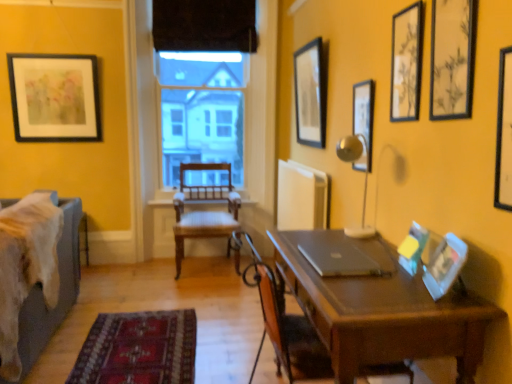
Question: From the image's perspective, is sleek silver laptop at center located beneath matte black picture frame at upper right, positioned as the 6th picture frame in right-to-left order?

Choices:
 (A) no
 (B) yes

Answer: (B)

Question: From a real-world perspective, is sleek silver laptop at center on top of matte black picture frame at upper right, positioned as the 6th picture frame in right-to-left order?

Choices:
 (A) yes
 (B) no

Answer: (B)

Question: Is sleek silver laptop at center at the right side of matte black picture frame at upper right, positioned as the 6th picture frame in right-to-left order?

Choices:
 (A) yes
 (B) no

Answer: (B)

Question: Considering the relative sizes of sleek silver laptop at center and matte black picture frame at upper right, which appears as the 3th picture frame when viewed from the left, in the image provided, is sleek silver laptop at center wider than matte black picture frame at upper right, which appears as the 3th picture frame when viewed from the left,?

Choices:
 (A) yes
 (B) no

Answer: (A)

Question: Is sleek silver laptop at center taller than matte black picture frame at upper right, positioned as the 6th picture frame in right-to-left order?

Choices:
 (A) no
 (B) yes

Answer: (A)

Question: Is black velvet curtain at upper center in front of or behind matte plastic picture frame at right, marked as the 5th picture frame in a right-to-left arrangement, in the image?

Choices:
 (A) front
 (B) behind

Answer: (B)

Question: Is black velvet curtain at upper center inside the boundaries of matte plastic picture frame at right, marked as the 5th picture frame in a right-to-left arrangement, or outside?

Choices:
 (A) outside
 (B) inside

Answer: (A)

Question: Considering the relative positions of black velvet curtain at upper center and matte plastic picture frame at right, which is counted as the 5th picture frame, starting from the back, in the image provided, is black velvet curtain at upper center to the left or to the right of matte plastic picture frame at right, which is counted as the 5th picture frame, starting from the back,?

Choices:
 (A) right
 (B) left

Answer: (B)

Question: From the image's perspective, is black velvet curtain at upper center above or below matte plastic picture frame at right, acting as the fourth picture frame starting from the front?

Choices:
 (A) below
 (B) above

Answer: (B)

Question: In terms of size, does matte black picture frame at upper left, placed as the 1th picture frame when sorted from left to right, appear bigger or smaller than wooden chair at center?

Choices:
 (A) big
 (B) small

Answer: (B)

Question: Considering the positions of matte black picture frame at upper left, placed as the eighth picture frame when sorted from front to back, and wooden chair at center in the image, is matte black picture frame at upper left, placed as the eighth picture frame when sorted from front to back, taller or shorter than wooden chair at center?

Choices:
 (A) short
 (B) tall

Answer: (A)

Question: Is matte black picture frame at upper left, placed as the 1th picture frame when sorted from left to right, to the left or to the right of wooden chair at center in the image?

Choices:
 (A) left
 (B) right

Answer: (A)

Question: From the image's perspective, is matte black picture frame at upper left, the first picture frame positioned from the back, located above or below wooden chair at center?

Choices:
 (A) below
 (B) above

Answer: (B)

Question: Is point (448, 276) positioned closer to the camera than point (419, 46)?

Choices:
 (A) closer
 (B) farther

Answer: (A)

Question: Considering the positions of matte plastic picture frame at right, which appears as the fifth picture frame when viewed from the left, and wooden picture frame at upper right, acting as the sixth picture frame starting from the left, in the image, is matte plastic picture frame at right, which appears as the fifth picture frame when viewed from the left, wider or thinner than wooden picture frame at upper right, acting as the sixth picture frame starting from the left,?

Choices:
 (A) thin
 (B) wide

Answer: (B)